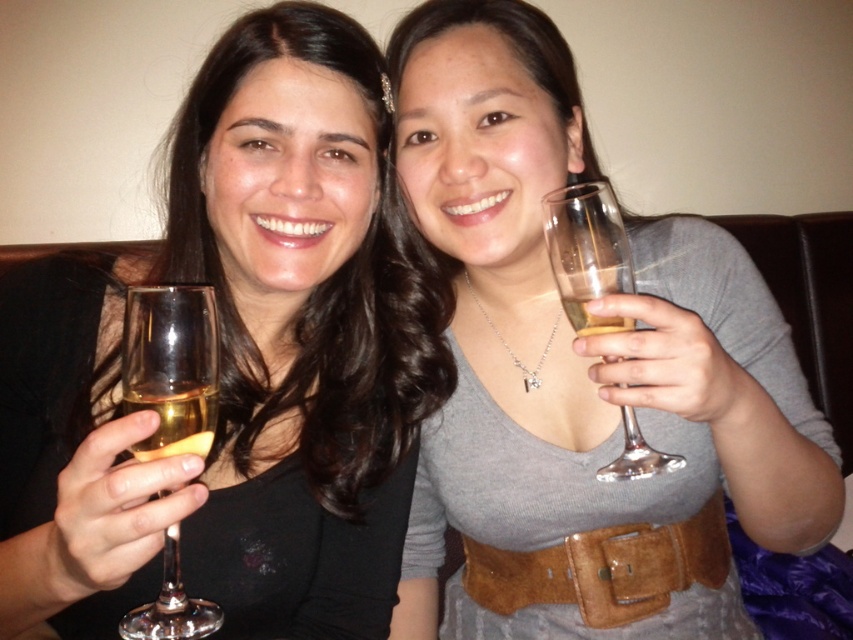
Between clear glass wine glass at left and clear glass wine glass at right, which one is positioned lower?

clear glass wine glass at left is lower down.

Is clear glass wine glass at left to the left of clear glass wine glass at right from the viewer's perspective?

Yes, clear glass wine glass at left is to the left of clear glass wine glass at right.

Measure the distance between point (160, 374) and camera.

The distance of point (160, 374) from camera is 18.99 inches.

Where is `clear glass wine glass at left`? clear glass wine glass at left is located at coordinates (171, 365).

You are a GUI agent. You are given a task and a screenshot of the screen. Output one action in this format:
    pyautogui.click(x=<x>, y=<y>)
    Task: Click on the brown suede belt at center
    The height and width of the screenshot is (640, 853).
    Given the screenshot: What is the action you would take?
    pyautogui.click(x=604, y=568)

Between point (718, 493) and point (171, 404), which one is positioned in front?

Point (171, 404)

I want to click on brown suede belt at center, so click(604, 568).

Identify the location of brown suede belt at center. This screenshot has width=853, height=640. (604, 568).

Is matte glass at center wider than clear glass wine glass at right?

Yes.

Who is positioned more to the right, matte glass at center or clear glass wine glass at right?

From the viewer's perspective, matte glass at center appears more on the right side.

Where is `matte glass at center`? The image size is (853, 640). matte glass at center is located at coordinates click(x=582, y=369).